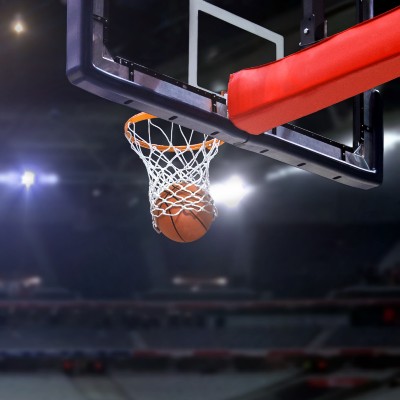
You are a GUI agent. You are given a task and a screenshot of the screen. Output one action in this format:
    pyautogui.click(x=<x>, y=<y>)
    Task: Click on the white border on backboard
    This screenshot has width=400, height=400.
    Given the screenshot: What is the action you would take?
    pyautogui.click(x=190, y=48), pyautogui.click(x=237, y=20), pyautogui.click(x=280, y=49), pyautogui.click(x=213, y=96)